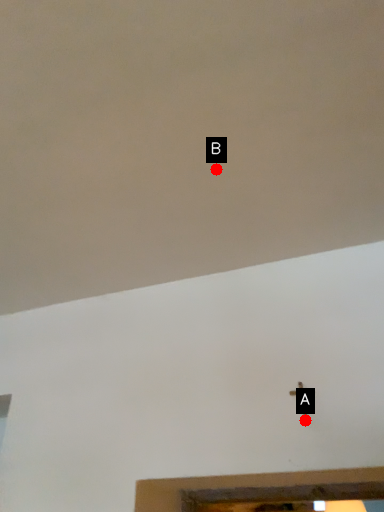
Question: Two points are circled on the image, labeled by A and B beside each circle. Which point is closer to the camera taking this photo?

Choices:
 (A) A is closer
 (B) B is closer

Answer: (B)